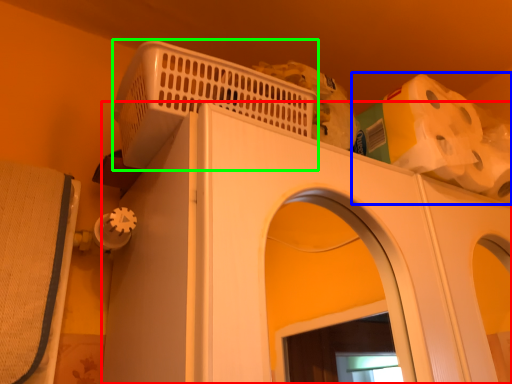
Question: Based on their relative distances, which object is nearer to home appliance (highlighted by a red box)? Choose from toilet paper (highlighted by a blue box) and basket (highlighted by a green box).

Choices:
 (A) toilet paper
 (B) basket

Answer: (B)